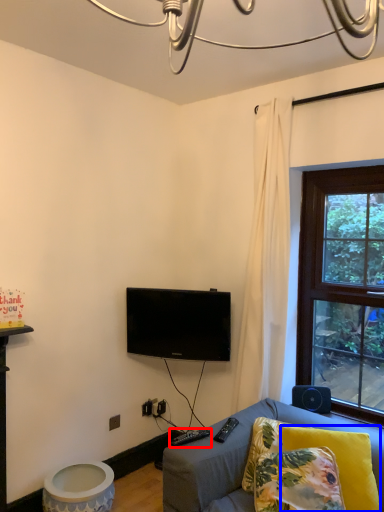
Question: Among these objects, which one is farthest to the camera, remote (highlighted by a red box) or pillow (highlighted by a blue box)?

Choices:
 (A) remote
 (B) pillow

Answer: (A)